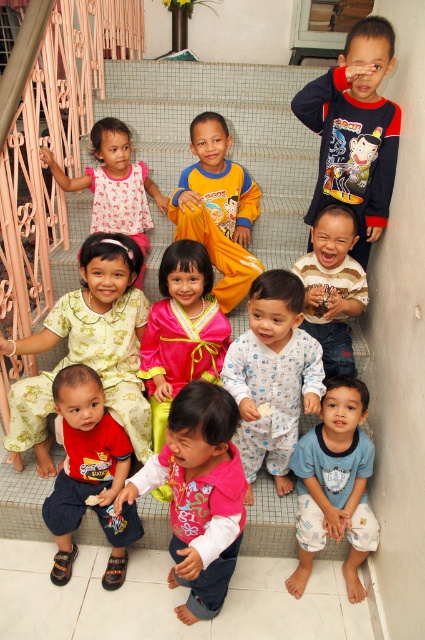
Which is above, red cotton shirt at lower left or striped jersey at center?

Positioned higher is striped jersey at center.

Can you confirm if red cotton shirt at lower left is positioned below striped jersey at center?

Indeed, red cotton shirt at lower left is positioned under striped jersey at center.

Measure the distance between point (130, 444) and camera.

Point (130, 444) is 6.45 feet away from camera.

At what (x,y) coordinates should I click in order to perform the action: click on red cotton shirt at lower left. Please return your answer as a coordinate pair (x, y). Image resolution: width=425 pixels, height=640 pixels. Looking at the image, I should click on (88, 474).

Identify the location of pink fabric shirt at center. (200, 492).

Between point (180, 470) and point (110, 563), which one is positioned behind?

Point (110, 563)

Does point (178, 531) come farther from viewer compared to point (90, 394)?

No, it is not.

Find the location of a particular element. This screenshot has width=425, height=640. pink fabric shirt at center is located at coordinates (200, 492).

Is point (190, 513) closer to viewer compared to point (156, 396)?

Yes.

Is pink fabric shirt at center smaller than pink satin dress at center?

Incorrect, pink fabric shirt at center is not smaller in size than pink satin dress at center.

Find the location of a particular element. The width and height of the screenshot is (425, 640). pink fabric shirt at center is located at coordinates (200, 492).

Image resolution: width=425 pixels, height=640 pixels. I want to click on pink fabric shirt at center, so click(200, 492).